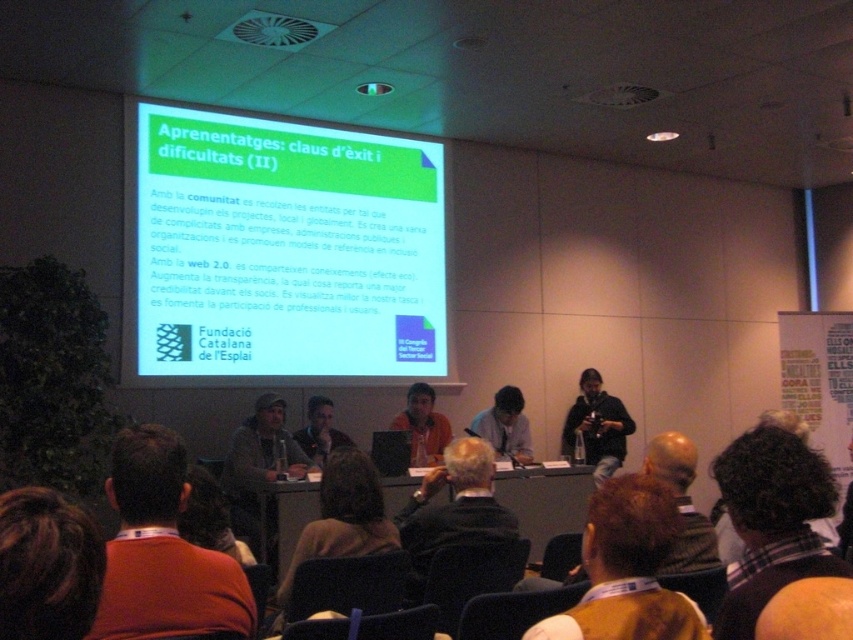
You are standing in the conference room and want to move to the point at coordinates point (300, 237). The conference room has a 15 feet wide door at the back. Can you walk through the door to reach the point?

The distance between you and the point (300, 237) is 20.82 feet. The door is 15 feet wide, so you can walk through the door to reach the point as the distance is sufficient.

You are an attendee at the conference and want to locate the point where the speaker is pointing to on the presentation slide. The point is labeled as point (279, 252). Where exactly is this point located on the screen?

The point (279, 252) is located on the green matte projector screen at upper center.

You are an attendee at the conference and want to take a photo of the orange shirt at center and the green matte projector screen at upper center. Which object should you focus on first if you want to capture both in the same frame?

You should focus on the green matte projector screen at upper center first because it is to the left of the orange shirt at center, so adjusting the camera to include both would require framing from the leftmost object to the rightmost object.